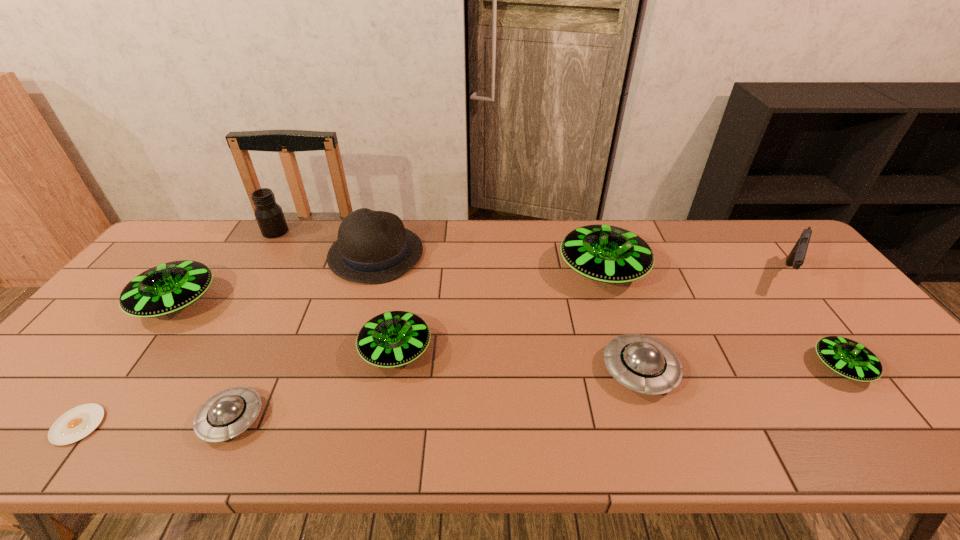
The height and width of the screenshot is (540, 960). I want to click on the smallest green saucer, so click(850, 359).

In order to click on the rightmost saucer in this screenshot , I will do `click(850, 359)`.

Find the location of a particular element. the smaller gray saucer is located at coordinates (225, 415).

Image resolution: width=960 pixels, height=540 pixels. I want to click on the fifth saucer from right to left, so click(x=225, y=415).

You are a GUI agent. You are given a task and a screenshot of the screen. Output one action in this format:
    pyautogui.click(x=<x>, y=<y>)
    Task: Click on the shortest object
    The height and width of the screenshot is (540, 960).
    Given the screenshot: What is the action you would take?
    (77, 423)

Identify the location of egg yolk. (77, 423).

Image resolution: width=960 pixels, height=540 pixels. What are the coordinates of `free space located 0.100m on the right of the eighth object from right to left` in the screenshot? It's located at (318, 232).

Find the location of a particular element. vacant space situated on the front-facing side of the bowler hat is located at coordinates (470, 254).

The width and height of the screenshot is (960, 540). I want to click on free space located 0.080m on the back of the second green saucer from right to left, so click(589, 230).

You are a GUI agent. You are given a task and a screenshot of the screen. Output one action in this format:
    pyautogui.click(x=<x>, y=<y>)
    Task: Click on the vacant space located at the muzzle of the gun
    Image resolution: width=960 pixels, height=540 pixels.
    Given the screenshot: What is the action you would take?
    pyautogui.click(x=827, y=327)